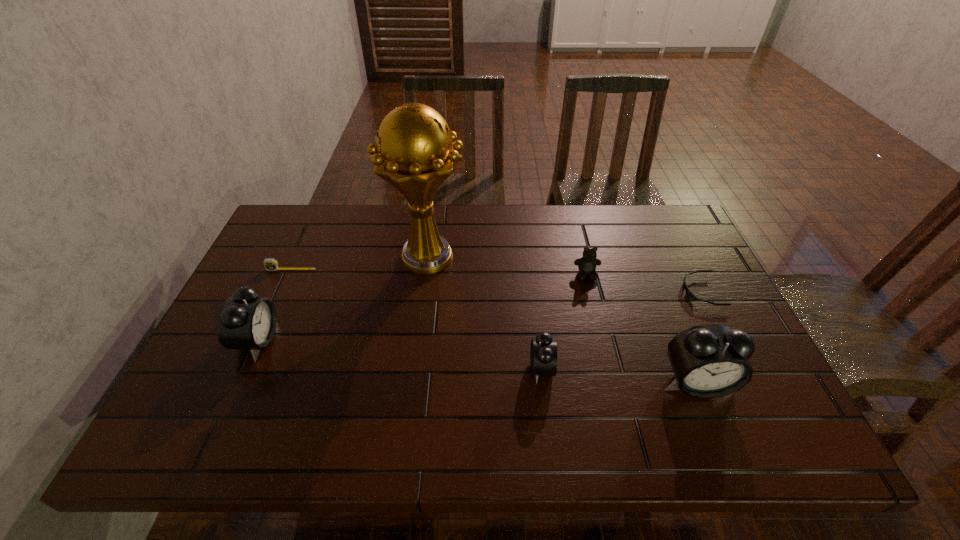
At what (x,y) coordinates should I click in order to perform the action: click on object present at the far edge. Please return your answer as a coordinate pair (x, y). The height and width of the screenshot is (540, 960). Looking at the image, I should click on (414, 152).

In order to click on alarm clock situated at the left edge in this screenshot , I will do `click(245, 321)`.

Find the location of a particular element. The image size is (960, 540). tape measure that is positioned at the left edge is located at coordinates (271, 264).

Locate an element on the screen. The image size is (960, 540). alarm clock present at the right edge is located at coordinates (708, 361).

Identify the location of sunglasses positioned at the right edge. This screenshot has width=960, height=540. (689, 294).

Locate an element on the screen. This screenshot has width=960, height=540. object that is at the near right corner is located at coordinates (708, 361).

Image resolution: width=960 pixels, height=540 pixels. Identify the location of free region at the far edge. (537, 227).

The image size is (960, 540). I want to click on vacant space at the near edge of the desktop, so click(x=342, y=379).

Where is `vacant space at the left edge of the desktop`? vacant space at the left edge of the desktop is located at coordinates (278, 330).

The height and width of the screenshot is (540, 960). In the image, there is a desktop. Find the location of `free space at the right edge`. free space at the right edge is located at coordinates (677, 302).